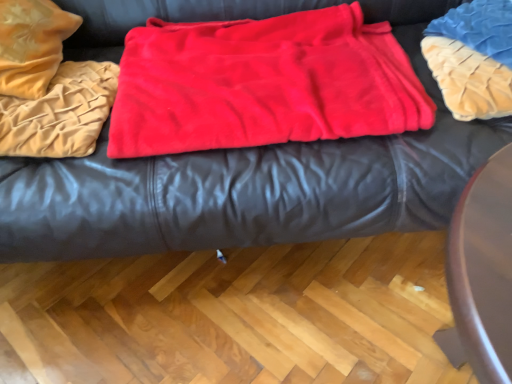
Question: In which direction should I rotate to look at red fleece blanket at center, marked as the 1th blanket in a right-to-left arrangement?

Choices:
 (A) left
 (B) right

Answer: (B)

Question: Is red fleece blanket at center, marked as the 1th blanket in a right-to-left arrangement, wider than velvet beige blanket at left, placed as the second blanket when sorted from right to left?

Choices:
 (A) yes
 (B) no

Answer: (A)

Question: Is the depth of red fleece blanket at center, marked as the 1th blanket in a right-to-left arrangement, less than that of velvet beige blanket at left, the 1th blanket in the left-to-right sequence?

Choices:
 (A) yes
 (B) no

Answer: (A)

Question: Is there a large distance between red fleece blanket at center, which is the second blanket from left to right, and velvet beige blanket at left, the 1th blanket in the left-to-right sequence?

Choices:
 (A) no
 (B) yes

Answer: (A)

Question: Is red fleece blanket at center, marked as the 1th blanket in a right-to-left arrangement, smaller than velvet beige blanket at left, the 1th blanket in the left-to-right sequence?

Choices:
 (A) yes
 (B) no

Answer: (B)

Question: Is red fleece blanket at center, marked as the 1th blanket in a right-to-left arrangement, to the left of velvet beige blanket at left, the 1th blanket in the left-to-right sequence, from the viewer's perspective?

Choices:
 (A) no
 (B) yes

Answer: (A)

Question: From a real-world perspective, is red fleece blanket at center, marked as the 1th blanket in a right-to-left arrangement, located higher than velvet beige blanket at left, placed as the second blanket when sorted from right to left?

Choices:
 (A) no
 (B) yes

Answer: (A)

Question: From a real-world perspective, is velvet-like red blanket at center located beneath red fleece blanket at center, which is the second blanket from left to right?

Choices:
 (A) no
 (B) yes

Answer: (B)

Question: Does velvet-like red blanket at center have a lesser width compared to red fleece blanket at center, marked as the 1th blanket in a right-to-left arrangement?

Choices:
 (A) yes
 (B) no

Answer: (B)

Question: Does velvet-like red blanket at center have a smaller size compared to red fleece blanket at center, marked as the 1th blanket in a right-to-left arrangement?

Choices:
 (A) no
 (B) yes

Answer: (A)

Question: Is velvet-like red blanket at center oriented towards red fleece blanket at center, which is the second blanket from left to right?

Choices:
 (A) no
 (B) yes

Answer: (B)

Question: From the image's perspective, is velvet-like red blanket at center over red fleece blanket at center, marked as the 1th blanket in a right-to-left arrangement?

Choices:
 (A) no
 (B) yes

Answer: (B)

Question: Is the position of velvet-like red blanket at center more distant than that of red fleece blanket at center, marked as the 1th blanket in a right-to-left arrangement?

Choices:
 (A) yes
 (B) no

Answer: (B)

Question: Considering the relative sizes of blue textured pillow at upper right and red fleece blanket at center, which is the second blanket from left to right, in the image provided, is blue textured pillow at upper right bigger than red fleece blanket at center, which is the second blanket from left to right,?

Choices:
 (A) yes
 (B) no

Answer: (B)